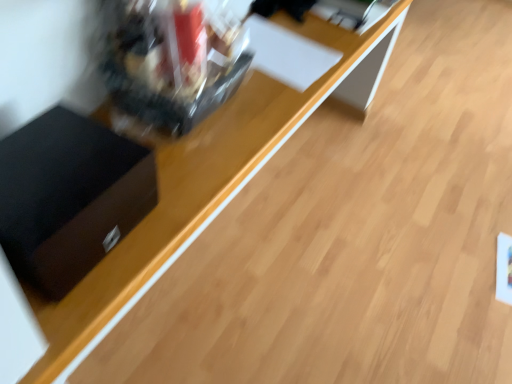
Locate an element on the screen. The height and width of the screenshot is (384, 512). black matte drawer at left is located at coordinates (69, 197).

What do you see at coordinates (69, 197) in the screenshot? I see `black matte drawer at left` at bounding box center [69, 197].

I want to click on black matte drawer at left, so click(x=69, y=197).